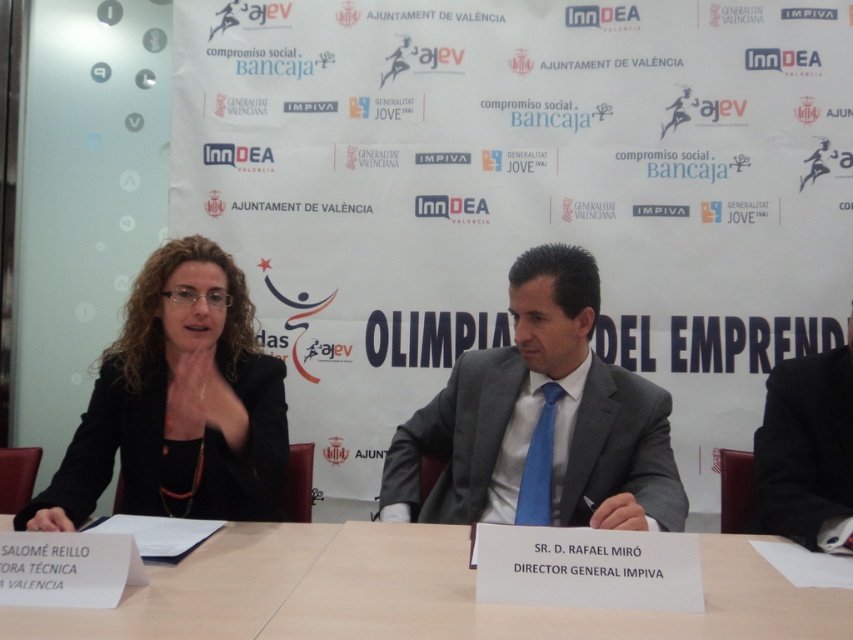
You are an attendee at this event and need to present your notes. The white paper at center and gray suit at center are in front of you. Which item is closer to the floor?

The white paper at center is located below gray suit at center, so the white paper at center is closer to the floor.

You are attending this event and need to identify the speaker wearing a black matte jacket at center and the one in a black suit at right. Based on their positions, which speaker is seated closer to the left end of the table?

The black matte jacket at center is to the left of the black suit at right, so the speaker in the black matte jacket at center is seated closer to the left end of the table.